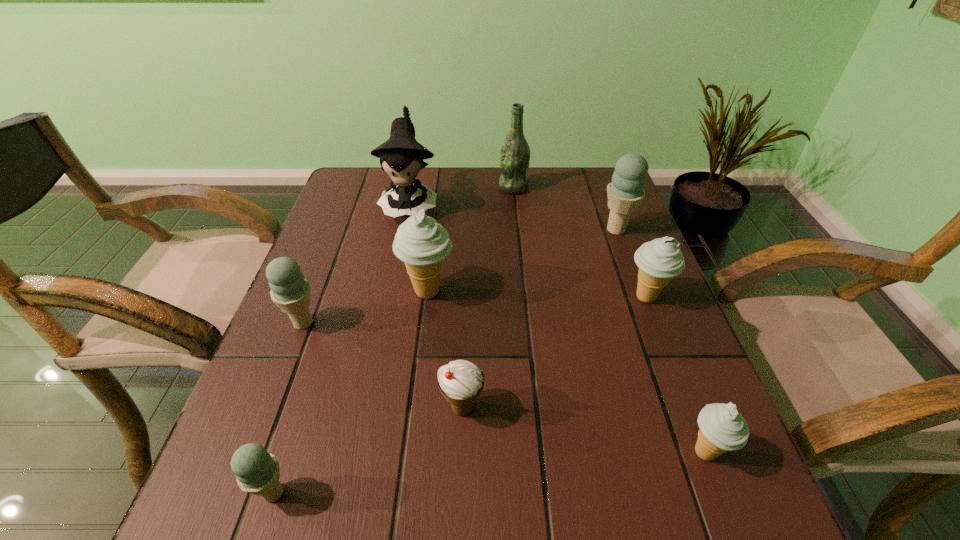
Find the location of `the eighth farthest object`. the eighth farthest object is located at coordinates (722, 428).

At what (x,y) coordinates should I click in order to perform the action: click on the nearest beige icecream. Please return your answer as a coordinate pair (x, y). The height and width of the screenshot is (540, 960). Looking at the image, I should click on (722, 428).

In order to click on the nearest object in this screenshot , I will do `click(257, 472)`.

I want to click on the nearest ice cream, so click(257, 472).

Locate an element on the screen. free spot located 0.200m at the face of the doll is located at coordinates (395, 282).

Identify the location of vacant region located 0.340m on the surface of the beer bottle. The height and width of the screenshot is (540, 960). (382, 188).

Find the location of a particular element. This screenshot has width=960, height=540. free location located on the surface of the beer bottle is located at coordinates (427, 188).

The image size is (960, 540). I want to click on vacant point located on the surface of the beer bottle, so click(465, 188).

This screenshot has width=960, height=540. I want to click on vacant area situated 0.120m on the left of the biggest blue ice cream, so click(552, 230).

The width and height of the screenshot is (960, 540). I want to click on vacant region located on the left of the biggest beige icecream, so click(x=333, y=292).